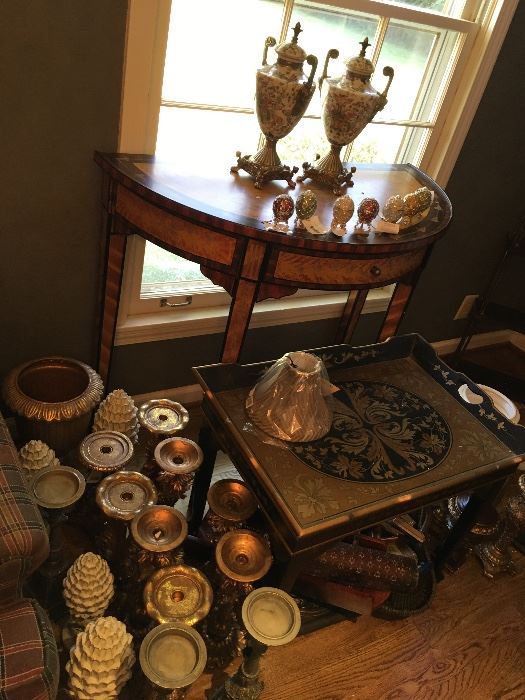
Where is `vase`? The width and height of the screenshot is (525, 700). vase is located at coordinates (283, 99).